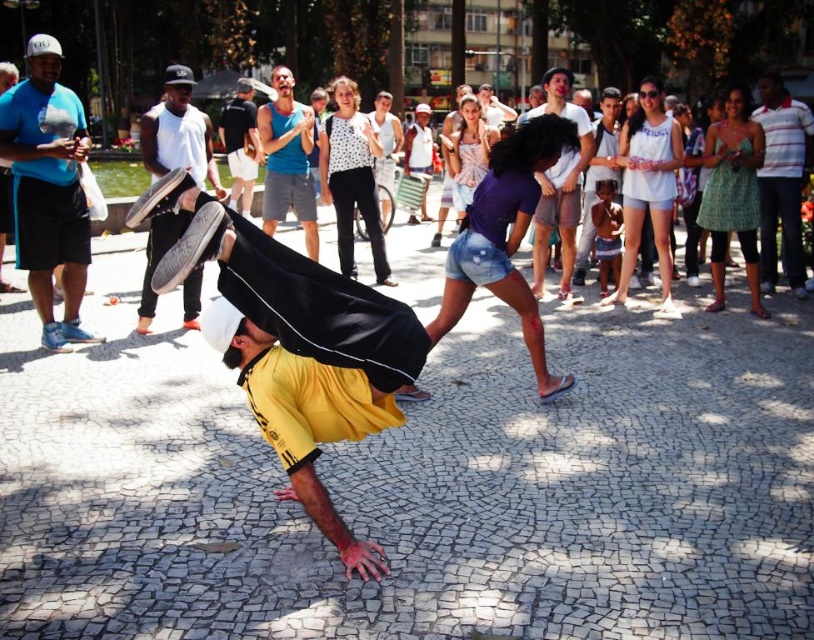
Question: Can you confirm if white canvas drum at upper left is positioned to the left of white striped shirt at right?

Choices:
 (A) yes
 (B) no

Answer: (A)

Question: Which of these objects is positioned farthest from the white striped shirt at right?

Choices:
 (A) white canvas drum at upper left
 (B) blue cotton shirt at center
 (C) blue fabric cap at upper left
 (D) white cotton t-shirt at center

Answer: (C)

Question: Does blue fabric cap at upper left have a lesser width compared to black cotton t-shirt at center?

Choices:
 (A) no
 (B) yes

Answer: (B)

Question: Can you confirm if blue cotton shirt at center is positioned below black cotton t-shirt at center?

Choices:
 (A) yes
 (B) no

Answer: (A)

Question: Which of the following is the closest to the observer?

Choices:
 (A) white canvas drum at upper left
 (B) blue fabric cap at upper left

Answer: (A)

Question: Estimate the real-world distances between objects in this image. Which object is closer to the white cotton t-shirt at center?

Choices:
 (A) white striped shirt at right
 (B) black cotton t-shirt at center
 (C) blue cotton shirt at center
 (D) white canvas drum at upper left

Answer: (A)